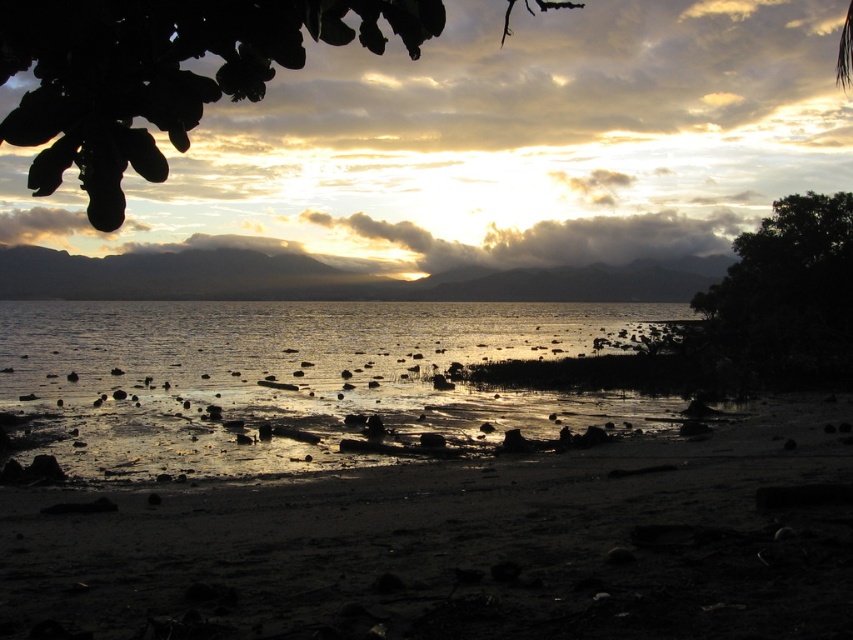
You are a photographer planning to capture the entire scene in one shot. Given the glistening water at center and the cloudy sky at upper center, which of these two elements occupies a wider area in the image?

The glistening water at center occupies a wider area than the cloudy sky at upper center because its width surpasses that of the cloudy sky at upper center.

You are standing at the shoreline of the serene coastal scene. You notice a specific point marked at coordinates point (466, 547). What type of terrain feature is located at that exact point?

The terrain feature at point (466, 547) is dull sand at lower center.